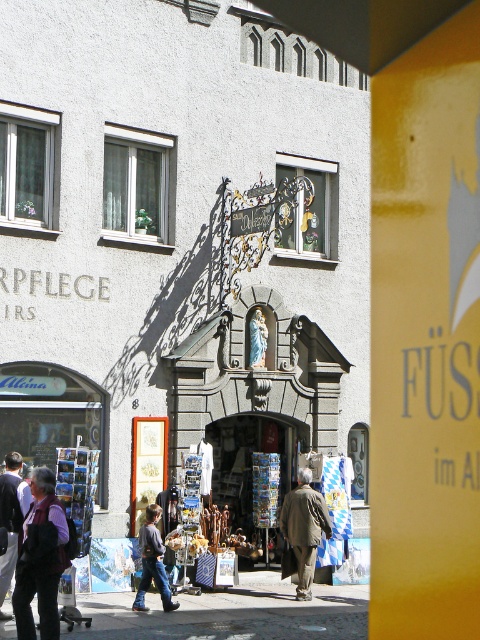
Between matte gray building at center and dark brown leather jacket at lower left, which one appears on the right side from the viewer's perspective?

matte gray building at center

Who is higher up, matte gray building at center or dark brown leather jacket at lower left?

matte gray building at center is above.

Does point (239, 225) lie in front of point (4, 579)?

That is False.

You are a GUI agent. You are given a task and a screenshot of the screen. Output one action in this format:
    pyautogui.click(x=<x>, y=<y>)
    Task: Click on the matte gray building at center
    
    Given the screenshot: What is the action you would take?
    pyautogui.click(x=180, y=243)

Which of these two, matte gray building at center or denim jeans at lower center, stands shorter?

matte gray building at center

Which of these two, matte gray building at center or denim jeans at lower center, stands taller?

Standing taller between the two is denim jeans at lower center.

Locate an element on the screen. matte gray building at center is located at coordinates (180, 243).

Image resolution: width=480 pixels, height=640 pixels. In order to click on matte gray building at center in this screenshot , I will do `click(180, 243)`.

Can you confirm if brown leather jacket at center is smaller than dark brown leather jacket at lower left?

No.

Which is in front, point (304, 493) or point (14, 468)?

Point (14, 468) is in front.

Locate an element on the screen. brown leather jacket at center is located at coordinates (303, 529).